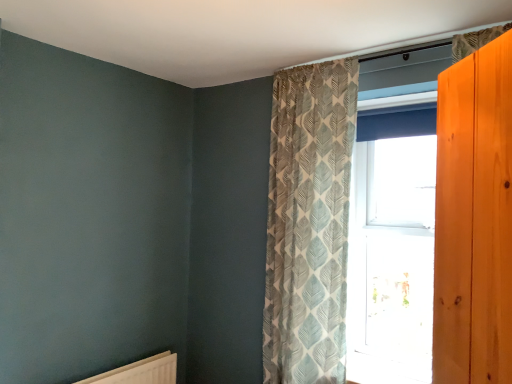
Question: Based on their positions, is clear glass window at center located to the left or right of textured beige curtain at upper center?

Choices:
 (A) left
 (B) right

Answer: (B)

Question: Considering the positions of clear glass window at center and textured beige curtain at upper center in the image, is clear glass window at center wider or thinner than textured beige curtain at upper center?

Choices:
 (A) thin
 (B) wide

Answer: (A)

Question: Estimate the real-world distances between objects in this image. Which object is closer to the clear glass window at center?

Choices:
 (A) textured beige curtain at upper center
 (B) white matte radiator at lower left

Answer: (A)

Question: Which object is positioned farthest from the white matte radiator at lower left?

Choices:
 (A) textured beige curtain at upper center
 (B) clear glass window at center

Answer: (B)